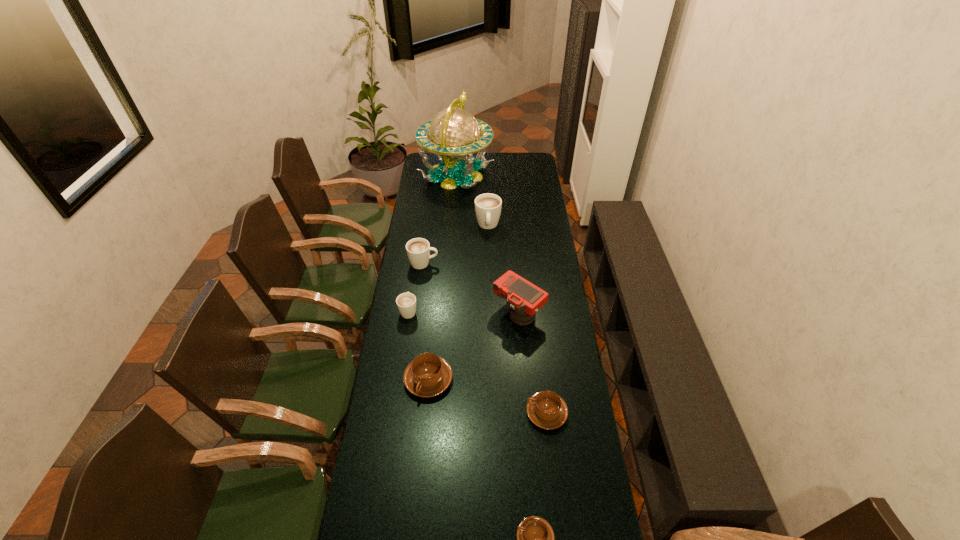
Where is `vacant area between the leftmost brown cappuccino and the tallest object`? This screenshot has width=960, height=540. vacant area between the leftmost brown cappuccino and the tallest object is located at coordinates (443, 277).

Locate an element on the screen. This screenshot has width=960, height=540. free point between the fifth nearest cappuccino and the camera is located at coordinates (470, 288).

Where is `unoccupied position between the fifth shortest object and the camera`? The image size is (960, 540). unoccupied position between the fifth shortest object and the camera is located at coordinates pos(470,288).

At what (x,y) coordinates should I click in order to perform the action: click on blank region between the camera and the farthest cappuccino. Please return your answer as a coordinate pair (x, y). This screenshot has height=540, width=960. Looking at the image, I should click on (503, 269).

This screenshot has height=540, width=960. Identify the location of blank region between the nearest white cappuccino and the second farthest cappuccino. (416, 287).

The height and width of the screenshot is (540, 960). Find the location of `free spot between the camera and the rightmost white cappuccino`. free spot between the camera and the rightmost white cappuccino is located at coordinates click(x=503, y=269).

Locate an element on the screen. This screenshot has width=960, height=540. object that is the second nearest to the smallest white cappuccino is located at coordinates (428, 375).

Identify which object is the fourth nearest to the camera. Please provide its 2D coordinates. Your answer should be formatted as a tuple, i.e. [(x, y)], where the tuple contains the x and y coordinates of a point satisfying the conditions above.

[(406, 302)]

Locate an element on the screen. This screenshot has height=540, width=960. cappuccino that stands as the closest to the smallest white cappuccino is located at coordinates (418, 249).

Select which cappuccino appears as the third closest to the camera. Please provide its 2D coordinates. Your answer should be formatted as a tuple, i.e. [(x, y)], where the tuple contains the x and y coordinates of a point satisfying the conditions above.

[(418, 249)]